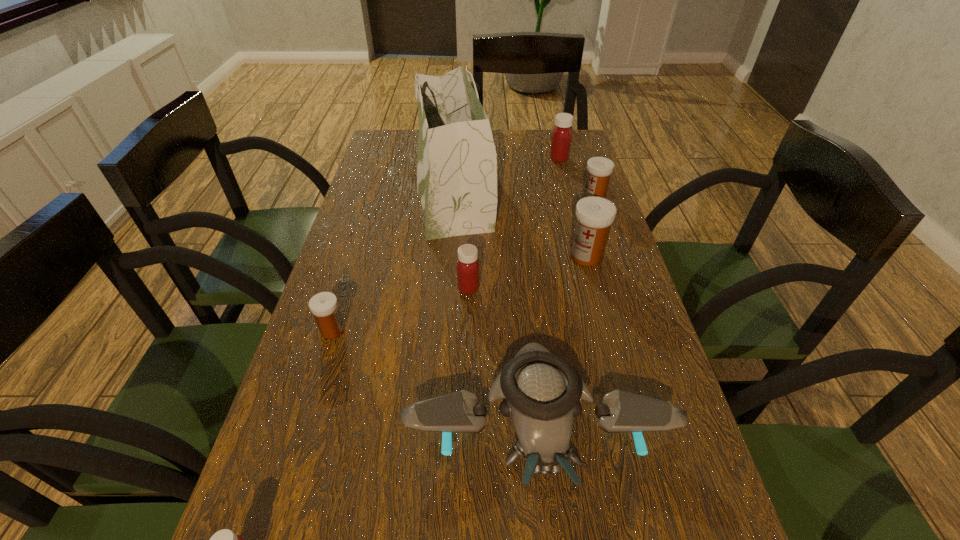
Locate an element on the screen. The width and height of the screenshot is (960, 540). green grocery bag is located at coordinates (457, 161).

Locate an element on the screen. Image resolution: width=960 pixels, height=540 pixels. grocery bag is located at coordinates (457, 161).

Identify the location of the farthest medicine. This screenshot has width=960, height=540. (561, 139).

At what (x,y) coordinates should I click in order to perform the action: click on the rightmost red medicine. Please return your answer as a coordinate pair (x, y). This screenshot has width=960, height=540. Looking at the image, I should click on (561, 139).

The width and height of the screenshot is (960, 540). Find the location of `the fourth nearest medicine`. the fourth nearest medicine is located at coordinates (594, 215).

Locate an element on the screen. The height and width of the screenshot is (540, 960). the biggest white medicine is located at coordinates (x=594, y=215).

Where is `the second farthest medicine`? the second farthest medicine is located at coordinates (599, 169).

Where is `the second smallest white medicine`? the second smallest white medicine is located at coordinates (599, 169).

Find the location of `the second red medicine from left to right`. the second red medicine from left to right is located at coordinates (467, 266).

Find the location of a particular element. the third medicine from left to right is located at coordinates click(467, 266).